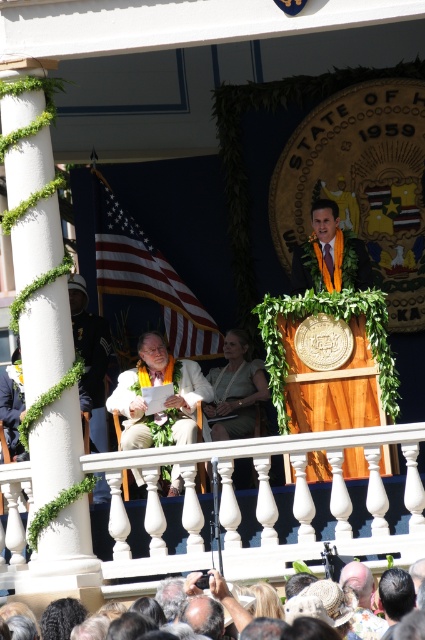
Does light brown leather jacket at center have a larger size compared to matte orange lei at center?

No, light brown leather jacket at center is not bigger than matte orange lei at center.

Consider the image. Who is taller, light brown leather jacket at center or matte orange lei at center?

matte orange lei at center is taller.

Where is `light brown leather jacket at center`? The height and width of the screenshot is (640, 425). light brown leather jacket at center is located at coordinates (166, 400).

Between american flag at left and gray hair at lower center, which one appears on the right side from the viewer's perspective?

gray hair at lower center is more to the right.

Is the position of american flag at left more distant than that of gray hair at lower center?

Yes.

Is point (110, 269) more distant than point (268, 600)?

Yes, it is.

This screenshot has width=425, height=640. In order to click on american flag at left in this screenshot , I will do `click(147, 276)`.

Which of these two, gray hair at lower center or matte orange lei at center, stands shorter?

matte orange lei at center

Is gray hair at lower center taller than matte orange lei at center?

Yes.

Image resolution: width=425 pixels, height=640 pixels. In order to click on gray hair at lower center in this screenshot , I will do `click(360, 592)`.